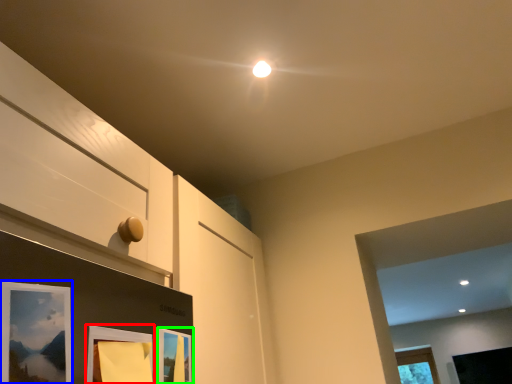
Question: Estimate the real-world distances between objects in this image. Which object is farther from picture frame (highlighted by a red box), picture frame (highlighted by a blue box) or picture frame (highlighted by a green box)?

Choices:
 (A) picture frame
 (B) picture frame

Answer: (A)